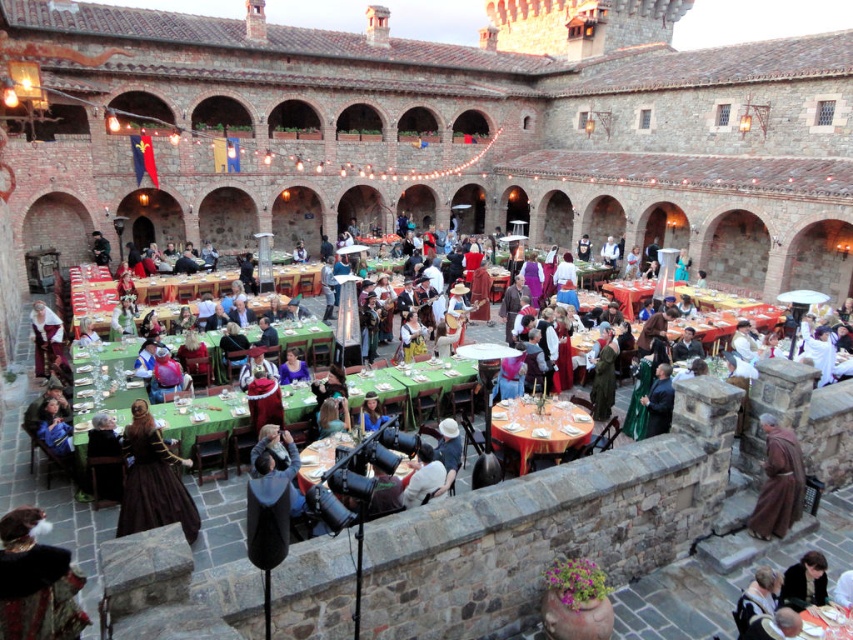
You are a guest at the medieval event and want to sit at the orange tablecloth at center. The green velvet robe at center belongs to a knight sitting at the table. Where should you sit relative to the knight?

The orange tablecloth at center is to the left of the green velvet robe at center, so you should sit to the left of the knight wearing the green velvet robe at center.